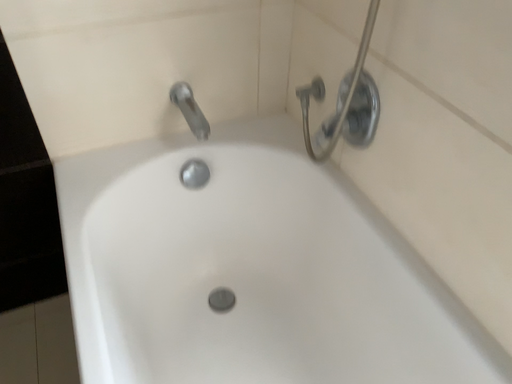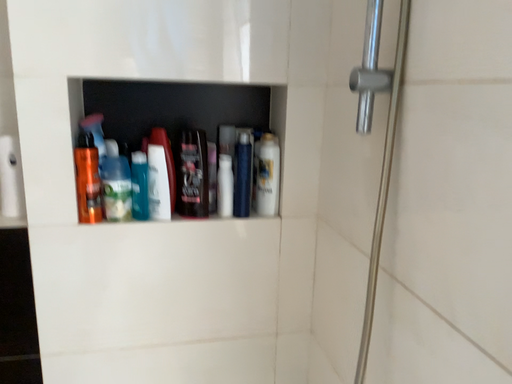
Question: How did the camera likely rotate when shooting the video?

Choices:
 (A) rotated right
 (B) rotated left

Answer: (B)